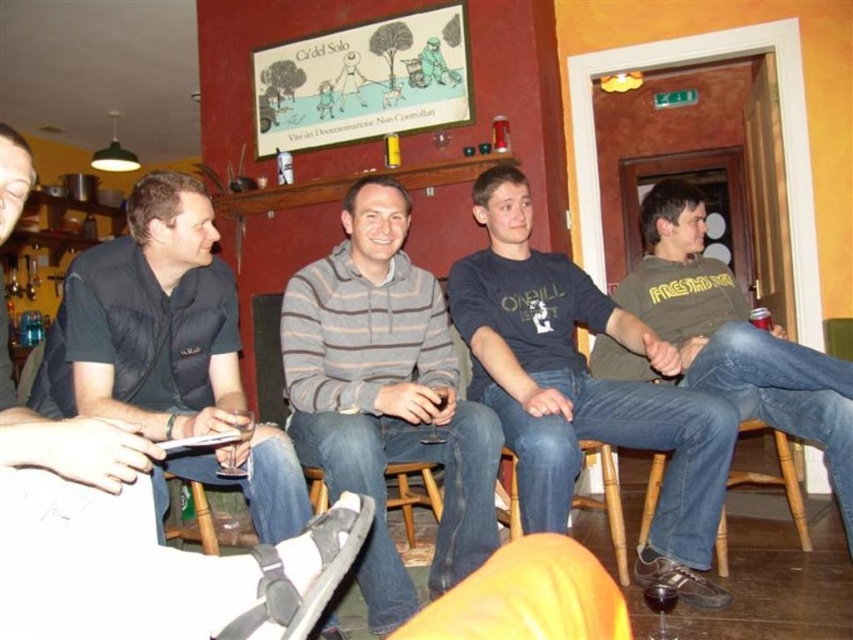
Question: Is gray striped sweater at center to the right of dark blue puffer jacket at left from the viewer's perspective?

Choices:
 (A) no
 (B) yes

Answer: (B)

Question: Which is nearer to the dark blue puffer jacket at left?

Choices:
 (A) wooden chair at center
 (B) dark blue cotton shirt at center
 (C) gray striped sweater at center
 (D) wooden stool at lower center

Answer: (C)

Question: Which point is farther to the camera?

Choices:
 (A) wooden stool at lower center
 (B) dark blue puffer jacket at left
 (C) jeans at right

Answer: (C)

Question: Does dark blue puffer jacket at left lie in front of brown wooden stool at lower right?

Choices:
 (A) no
 (B) yes

Answer: (B)

Question: Which point appears farthest from the camera in this image?

Choices:
 (A) (573, 493)
 (B) (166, 212)
 (C) (523, 524)
 (D) (415, 321)

Answer: (A)

Question: Is gray striped sweater at center smaller than yellow leather jacket at lower center?

Choices:
 (A) no
 (B) yes

Answer: (A)